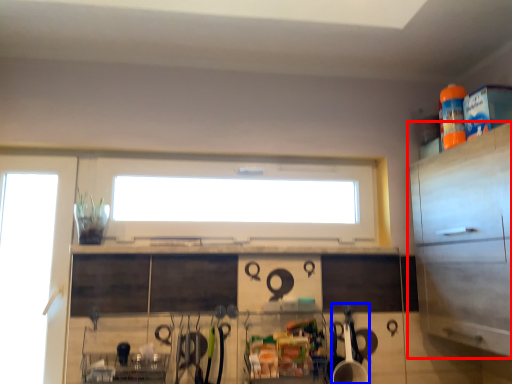
Question: Among these objects, which one is nearest to the camera, cabinetry (highlighted by a red box) or appliance (highlighted by a blue box)?

Choices:
 (A) cabinetry
 (B) appliance

Answer: (A)